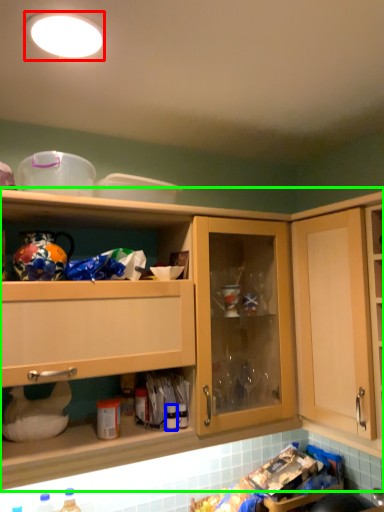
Question: Which object is positioned closest to lighting (highlighted by a red box)? Select from bottle (highlighted by a blue box) and cabinetry (highlighted by a green box).

Choices:
 (A) bottle
 (B) cabinetry

Answer: (B)